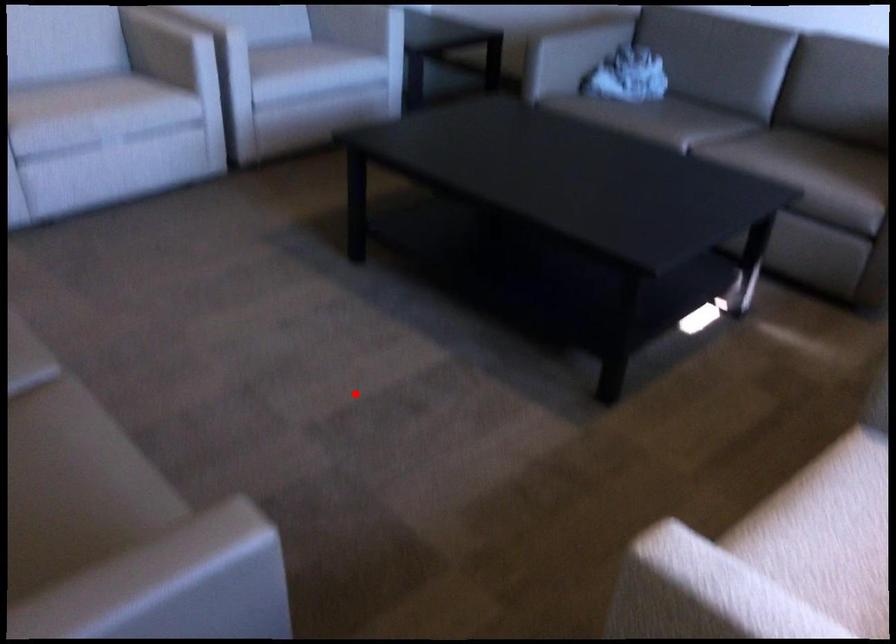
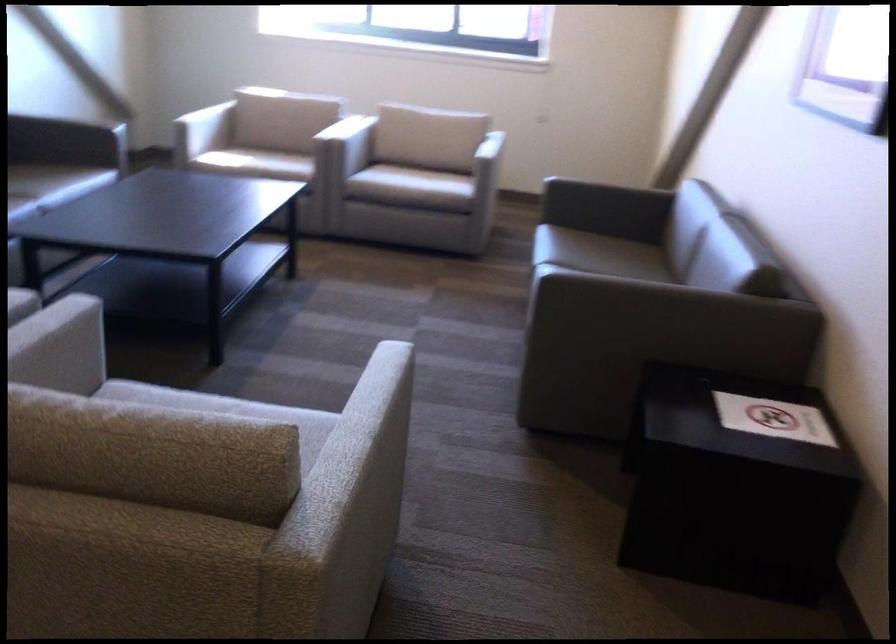
Question: I am providing you with two images of the same scene from different viewpoints. In image1, a red point is highlighted. Considering the same 3D point in image2, which of the following is correct?

Choices:
 (A) It is closer
 (B) It is farther

Answer: (B)